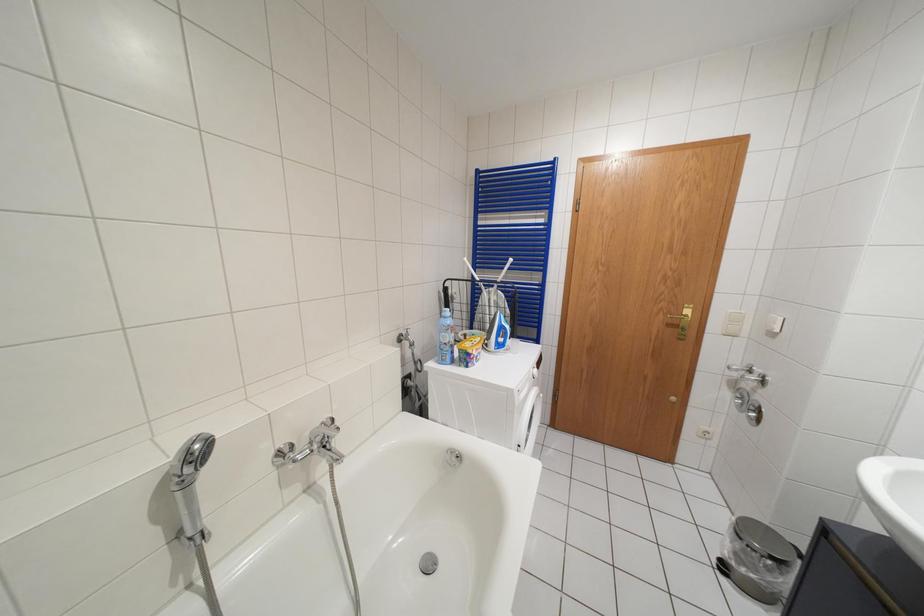
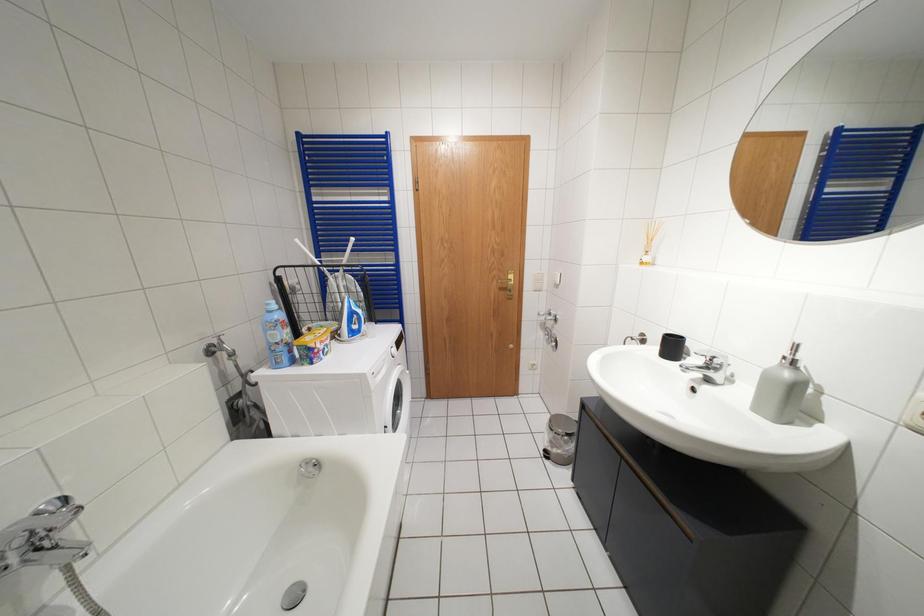
Question: The first image is from the beginning of the video and the second image is from the end. How did the camera likely rotate when shooting the video?

Choices:
 (A) Left
 (B) Right
 (C) Up
 (D) Down

Answer: (B)